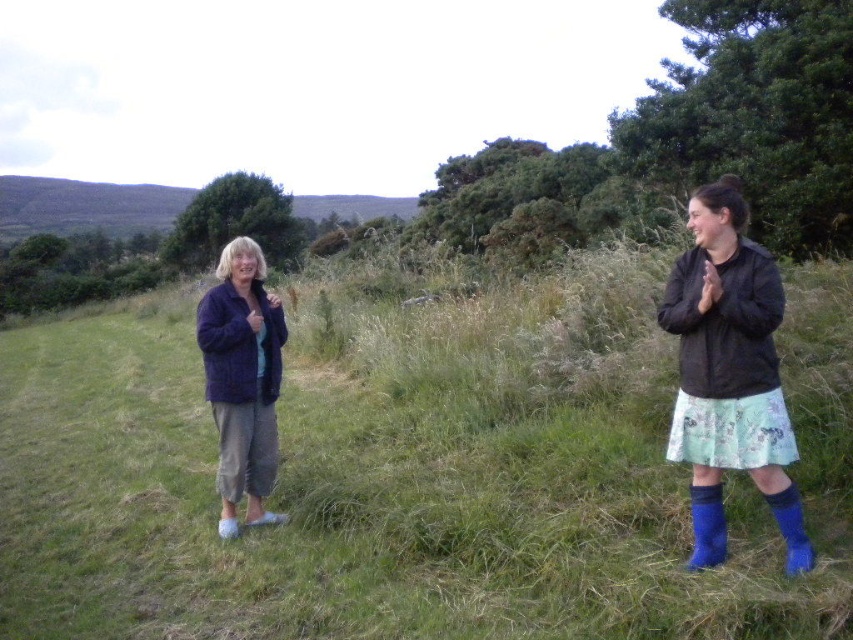
You are standing at the point marked as point (155, 589) in the image. You want to walk towards the nearest tree in the background. How far will you have to walk?

The distance between point (155, 589) and the viewer is 4.08 meters. However, the question asks for the distance to the nearest tree, which isn not provided in the Objects Description. Therefore, I cannot determine the exact distance to the nearest tree based on the given information.

You are a photographer trying to capture a photo of the two people in the scene. Considering the green grassy at center and the floral skirt at right, which one is taller?

The green grassy at center is much taller than the floral skirt at right.

You are standing in a grassy field and see two points in the scene. The first point is labeled as point (161, 339) and the second is point (212, 314). Which point is closer to you?

Point (161, 339) is closer to you because it is further to the viewer than point (212, 314).